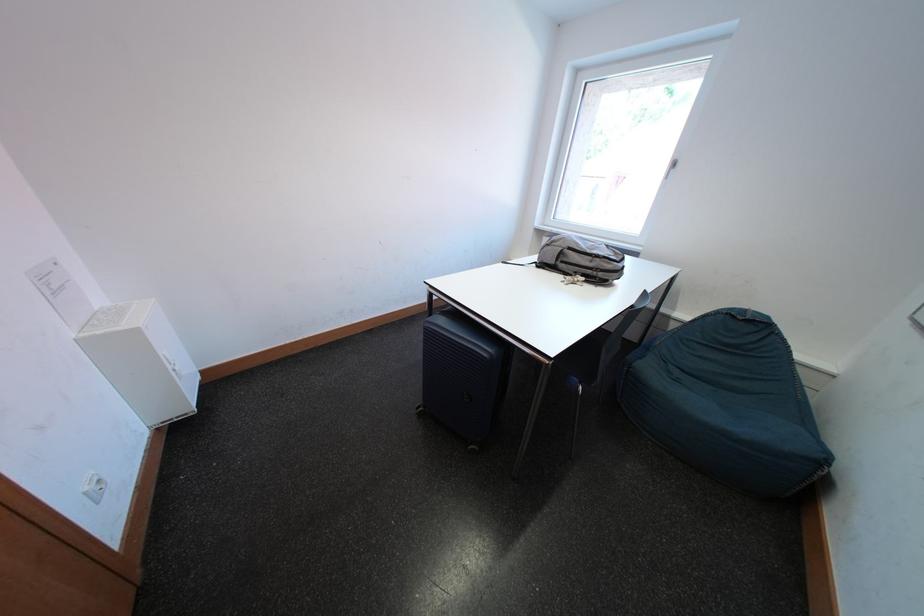
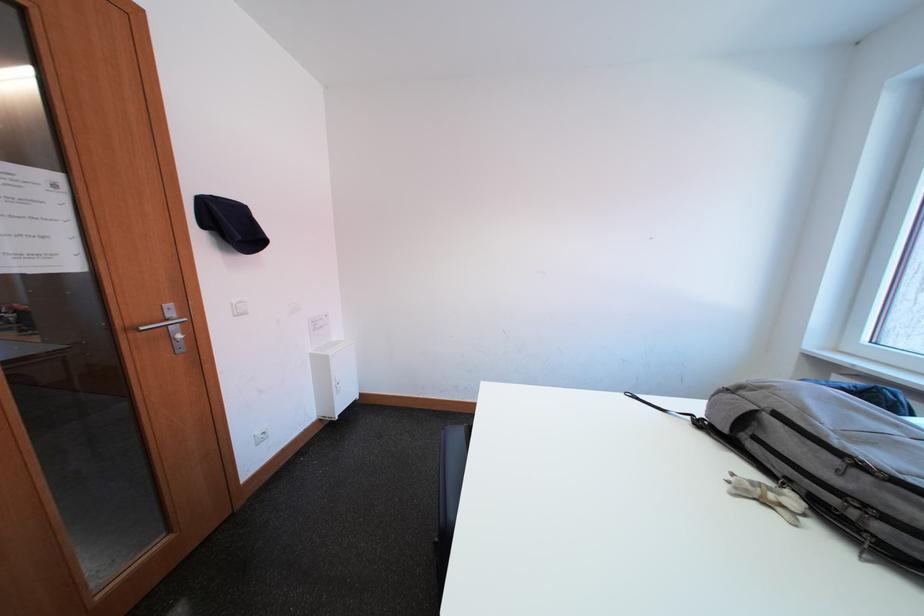
Locate, in the second image, the point that corresponds to point (600, 261) in the first image.

(844, 464)